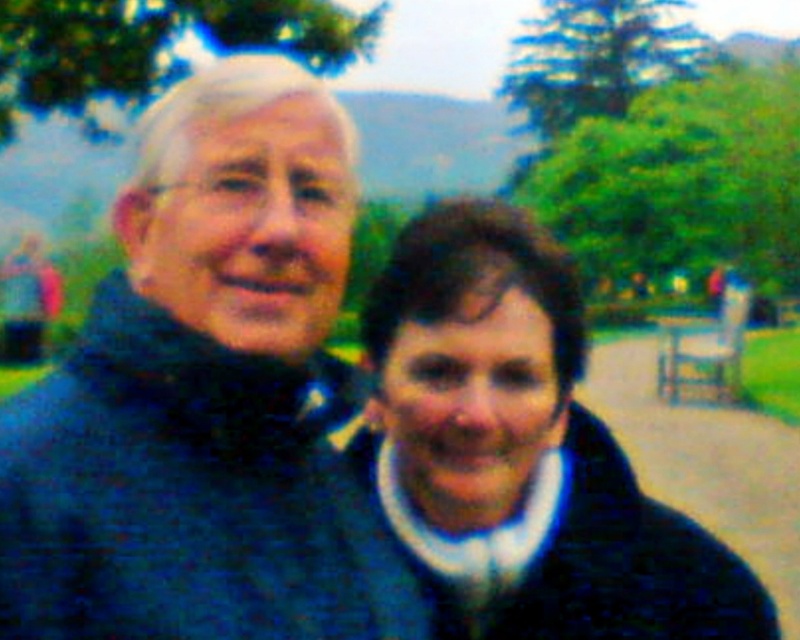
You are a photographer trying to capture a clear shot of the brown wooden bench at center. There is a person wearing a dark blue jacket at center blocking your view. Can you move the person to the right to get an unobstructed view of the bench?

The dark blue jacket at center is positioned on the left side of the brown wooden bench at center. Moving the person wearing the dark blue jacket at center to the right would place them further away from the bench, allowing for an unobstructed view of the brown wooden bench at center.

You are a photographer trying to capture a clear shot of the dark blue jacket at center from your current position. Considering the image is slightly blurred, what adjustment should you make to focus on the jacket?

Since the dark blue jacket at center is 2.43 meters from the camera, you should adjust the focus distance to approximately 2.43 meters to ensure the jacket is sharp and clear in the photo.